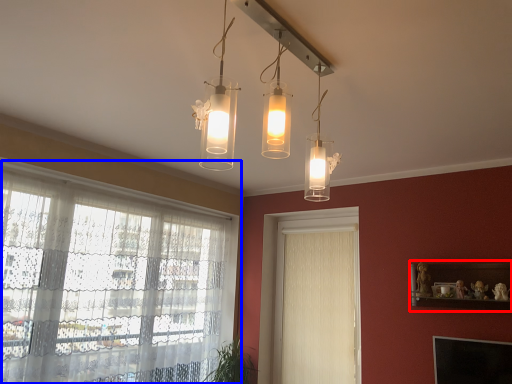
Question: Among these objects, which one is nearest to the camera, shelf (highlighted by a red box) or window (highlighted by a blue box)?

Choices:
 (A) shelf
 (B) window

Answer: (B)